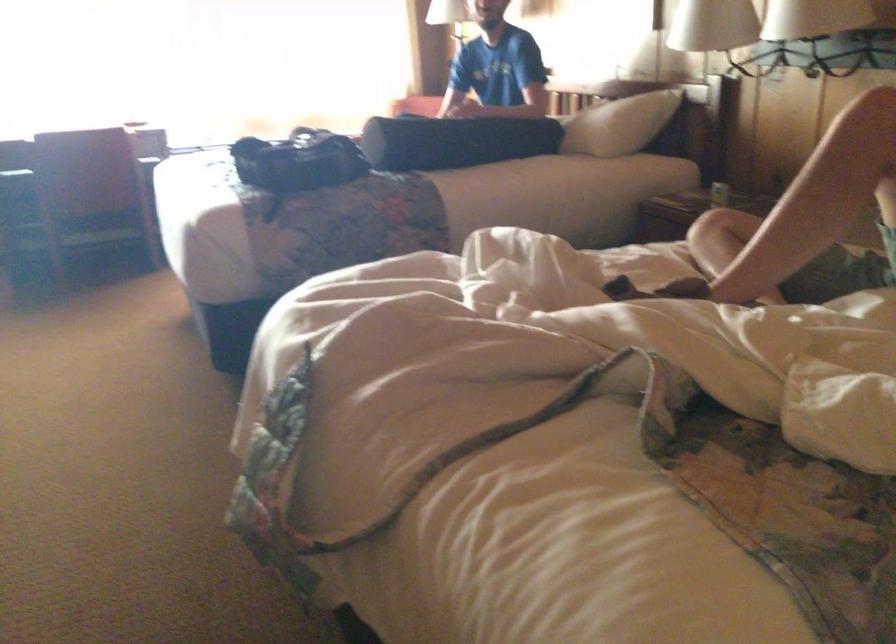
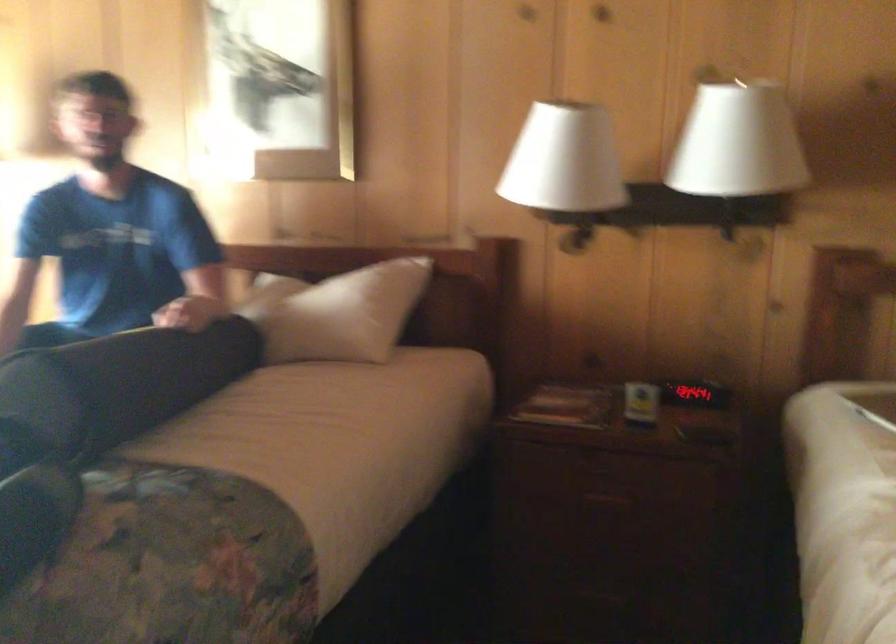
The point at (582, 113) is marked in the first image. Where is the corresponding point in the second image?

(340, 313)